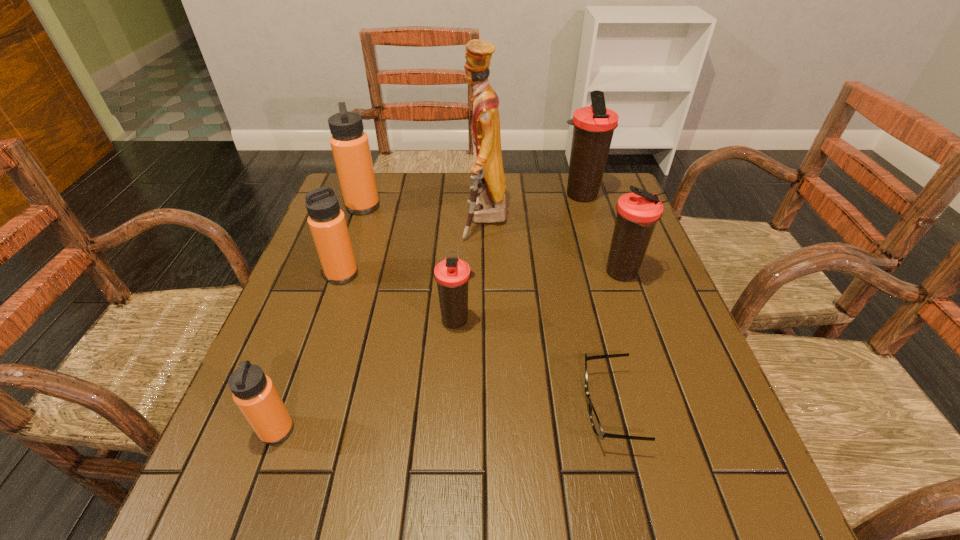
Locate an element on the screen. The image size is (960, 540). vacant position located on the front of the nearest orange thermos bottle is located at coordinates (256, 488).

The height and width of the screenshot is (540, 960). In order to click on vacant area situated 0.270m on the front-facing side of the black spectacles in this screenshot , I will do `click(437, 409)`.

You are a GUI agent. You are given a task and a screenshot of the screen. Output one action in this format:
    pyautogui.click(x=<x>, y=<y>)
    Task: Click on the free space located on the front-facing side of the black spectacles
    The height and width of the screenshot is (540, 960).
    Given the screenshot: What is the action you would take?
    pyautogui.click(x=491, y=409)

The height and width of the screenshot is (540, 960). I want to click on vacant space located 0.210m on the front-facing side of the black spectacles, so click(x=469, y=409).

Identify the location of nutcracker present at the far edge. (487, 204).

Image resolution: width=960 pixels, height=540 pixels. I want to click on spectacles located at the right edge, so click(594, 419).

Where is `object that is at the far left corner`? object that is at the far left corner is located at coordinates (350, 146).

Locate an element on the screen. The height and width of the screenshot is (540, 960). object present at the far right corner is located at coordinates (594, 125).

Identify the location of vacant space at the far edge. [x=439, y=187].

Find the location of `free location at the near edge`. free location at the near edge is located at coordinates (x=661, y=525).